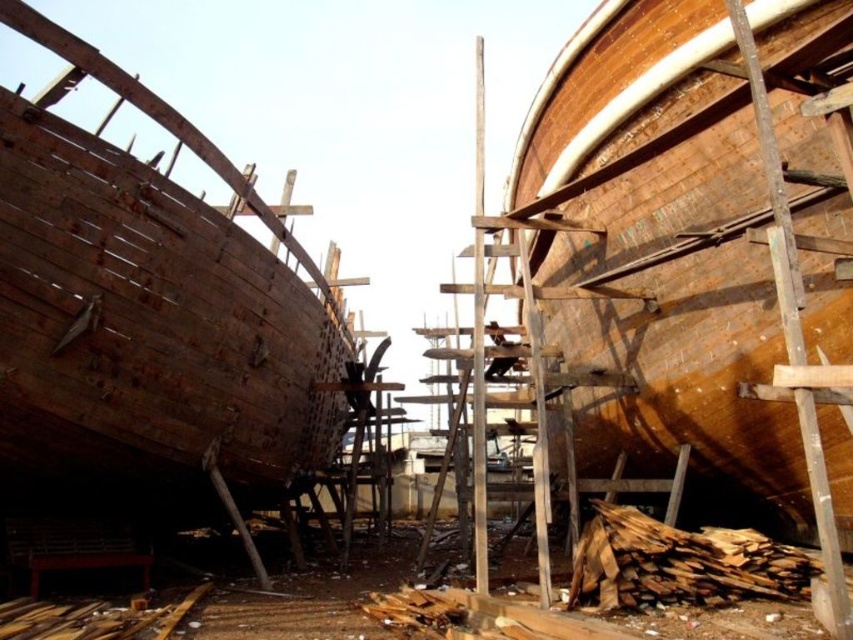
You are a shipbuilder inspecting the construction site. You need to determine if the rusty wood boat at left can be covered completely with the wooden planks at lower right. Based on their heights, can the planks cover the boat?

The rusty wood boat at left has a lesser height compared to wooden planks at lower right, so the wooden planks at lower right are taller and can cover the boat.

You are a shipbuilder standing at the lower part of the shipyard. You need to retrieve some wooden planks to work on the rusty wood boat at left. Are the wooden planks at lower right positioned below the boat?

The rusty wood boat at left is located above the wooden planks at lower right, so yes, the wooden planks at lower right are positioned below the boat.